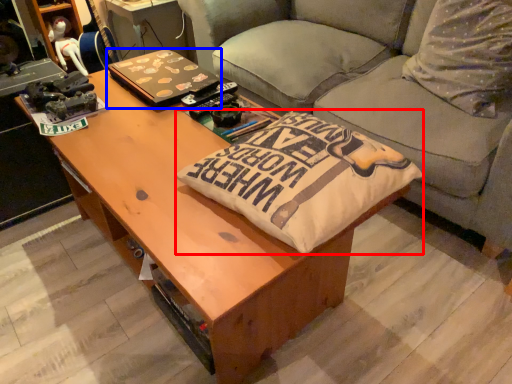
Question: Which object is closer to the camera taking this photo, throw pillow (highlighted by a red box) or laptop (highlighted by a blue box)?

Choices:
 (A) throw pillow
 (B) laptop

Answer: (A)